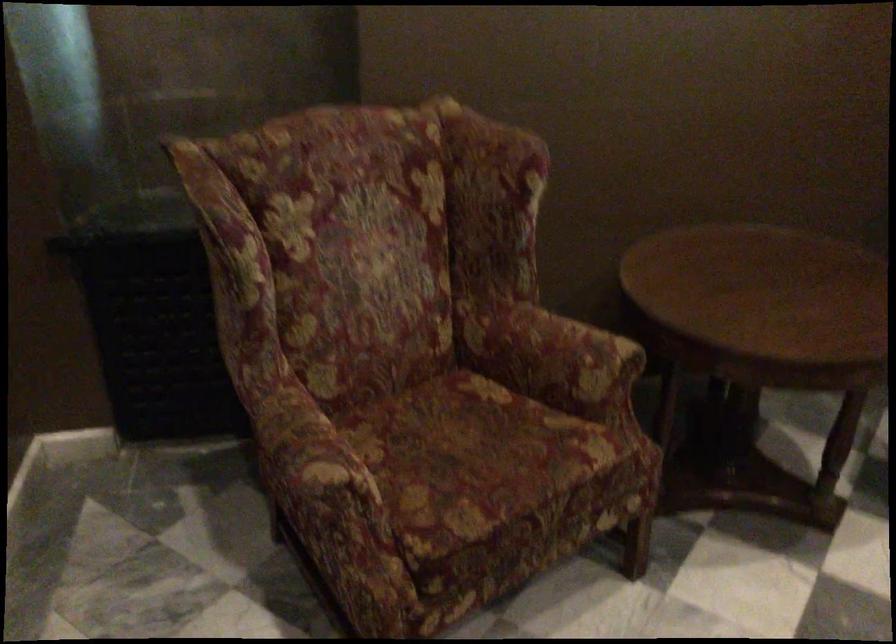
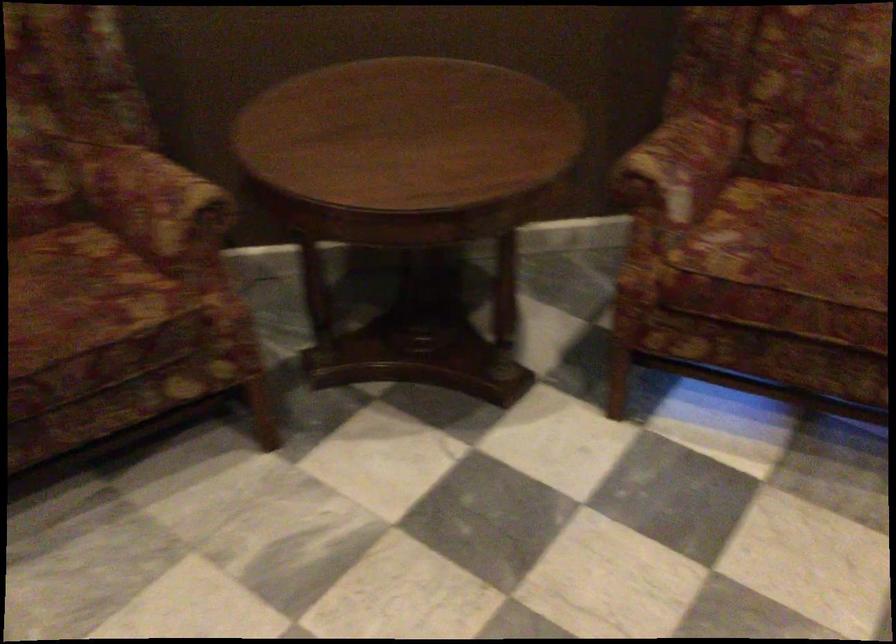
Locate, in the second image, the point that corresponds to pixel 521 435 in the first image.

(80, 292)